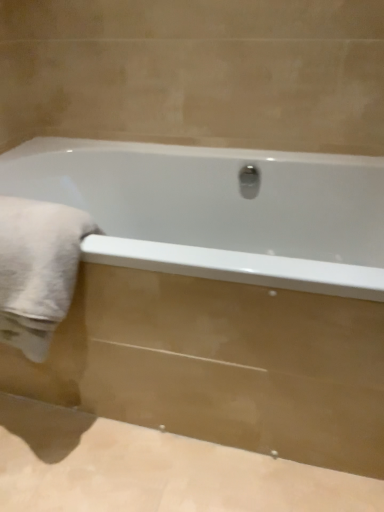
Question: Based on their sizes in the image, would you say white soft towel at left is bigger or smaller than white glossy bathtub at center?

Choices:
 (A) big
 (B) small

Answer: (B)

Question: Considering the relative positions of white soft towel at left and white glossy bathtub at center in the image provided, is white soft towel at left to the left or to the right of white glossy bathtub at center?

Choices:
 (A) right
 (B) left

Answer: (B)

Question: Relative to white glossy bathtub at center, is white soft towel at left in front or behind?

Choices:
 (A) front
 (B) behind

Answer: (B)

Question: In the image, is white glossy bathtub at center on the left side or the right side of white soft towel at left?

Choices:
 (A) left
 (B) right

Answer: (B)

Question: Is white glossy bathtub at center inside the boundaries of white soft towel at left, or outside?

Choices:
 (A) outside
 (B) inside

Answer: (A)

Question: From a real-world perspective, relative to white soft towel at left, is white glossy bathtub at center vertically above or below?

Choices:
 (A) below
 (B) above

Answer: (A)

Question: In terms of width, does white glossy bathtub at center look wider or thinner when compared to white soft towel at left?

Choices:
 (A) thin
 (B) wide

Answer: (B)